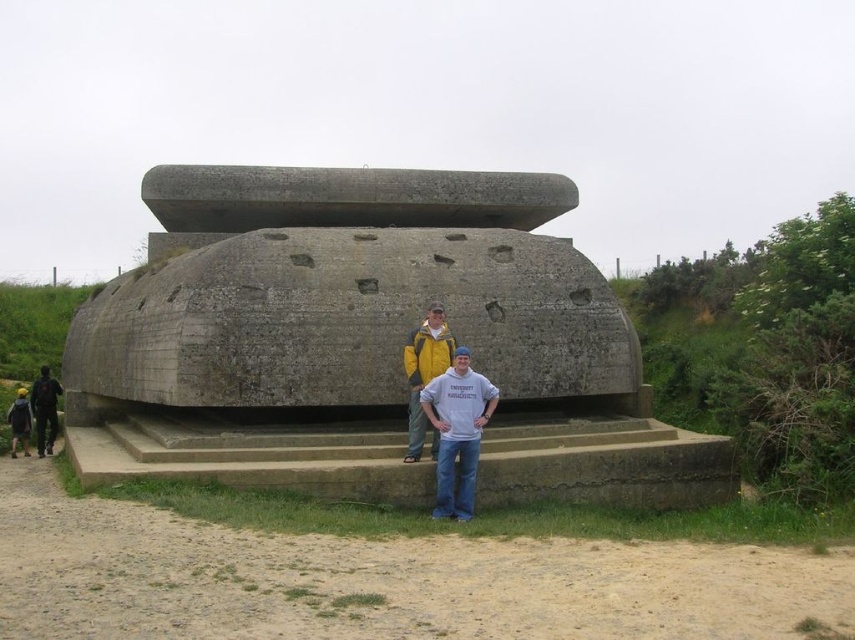
You are a photographer trying to capture a clear image of both the dark blue denim jacket at lower left and the dark blue jacket at lower left. Since they are both in the same area, which one might be easier to focus on and why?

The dark blue denim jacket at lower left has a larger size compared to the dark blue jacket at lower left, so it might be easier to focus on due to its larger size making it more prominent in the frame.

You are a photographer trying to capture a shot of the matte gray concrete statue at center and the dark blue denim jacket at lower left. Based on their positions, which object is located to the right of the other?

The matte gray concrete statue at center is positioned on the right side of the dark blue denim jacket at lower left.